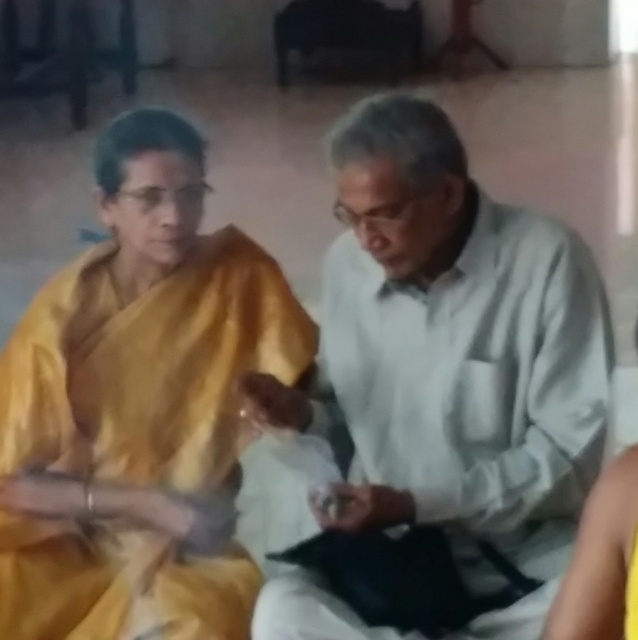
Question: Which point is closer to the camera?

Choices:
 (A) (265, 330)
 (B) (433, 244)

Answer: (B)

Question: Which of the following is the closest to the observer?

Choices:
 (A) (223, 444)
 (B) (491, 497)

Answer: (B)

Question: Is the position of white matte shirt at center more distant than that of yellow silk saree at left?

Choices:
 (A) yes
 (B) no

Answer: (B)

Question: Can you confirm if white matte shirt at center is thinner than yellow silk saree at left?

Choices:
 (A) no
 (B) yes

Answer: (B)

Question: Observing the image, what is the correct spatial positioning of white matte shirt at center in reference to yellow silk saree at left?

Choices:
 (A) right
 (B) left

Answer: (A)